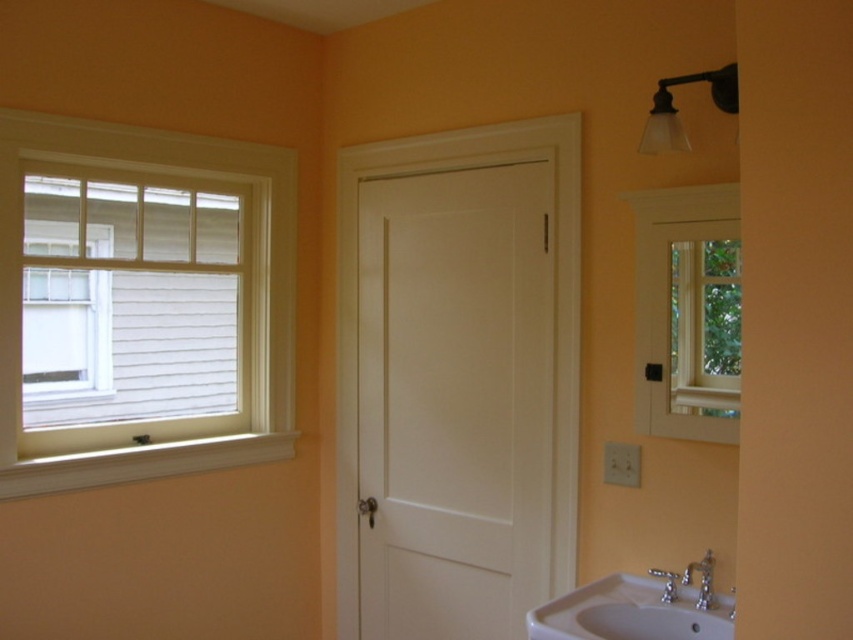
Question: Which point is farther from the camera taking this photo?

Choices:
 (A) (691, 413)
 (B) (607, 589)
 (C) (15, 298)
 (D) (709, 609)

Answer: (C)

Question: Which of these objects is positioned closest to the silver metallic faucet at lower right?

Choices:
 (A) white painted wood window at left
 (B) white wood window at upper right
 (C) white porcelain sink at lower right

Answer: (C)

Question: In this image, where is white wood window at upper right located relative to white porcelain sink at lower right?

Choices:
 (A) right
 (B) left

Answer: (A)

Question: Which point is farther from the camera taking this photo?

Choices:
 (A) (637, 408)
 (B) (606, 608)

Answer: (A)

Question: Where is white painted wood window at left located in relation to white porcelain sink at lower right in the image?

Choices:
 (A) left
 (B) right

Answer: (A)

Question: Can you confirm if white painted wood window at left is wider than silver metallic faucet at lower right?

Choices:
 (A) no
 (B) yes

Answer: (B)